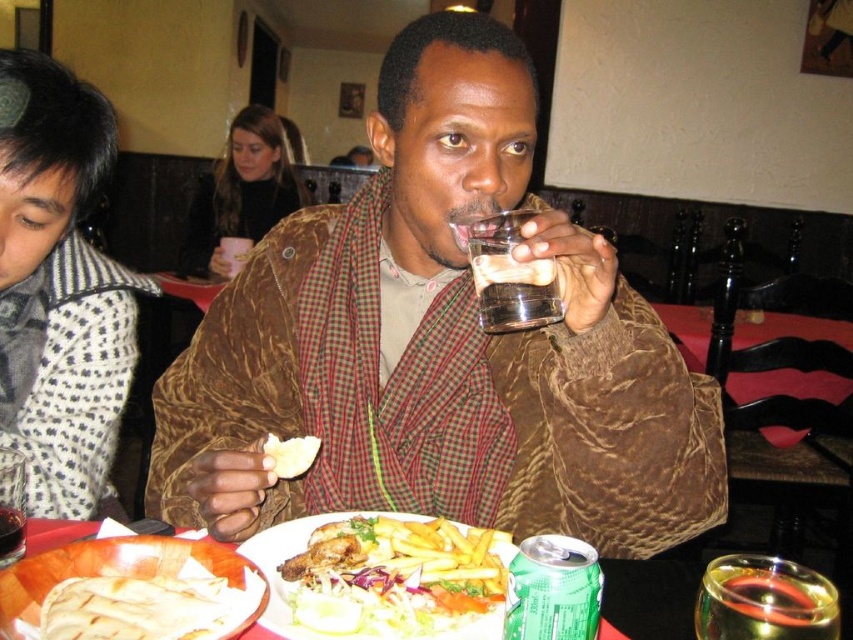
Question: Does patterned fabric shirt at left appear under white bread at center?

Choices:
 (A) yes
 (B) no

Answer: (B)

Question: Among these points, which one is farthest from the camera?

Choices:
 (A) (57, 548)
 (B) (776, 596)
 (C) (270, 456)

Answer: (C)

Question: Does black sweater at upper center appear on the left side of white bread at center?

Choices:
 (A) no
 (B) yes

Answer: (B)

Question: Which point is closer to the camera taking this photo?

Choices:
 (A) (270, 195)
 (B) (28, 355)
 (C) (730, 595)

Answer: (C)

Question: Which point appears closest to the camera in this image?

Choices:
 (A) (299, 465)
 (B) (229, 236)
 (C) (65, 545)
 (D) (340, 602)

Answer: (D)

Question: Does patterned fabric shirt at left appear on the left side of black sweater at upper center?

Choices:
 (A) yes
 (B) no

Answer: (B)